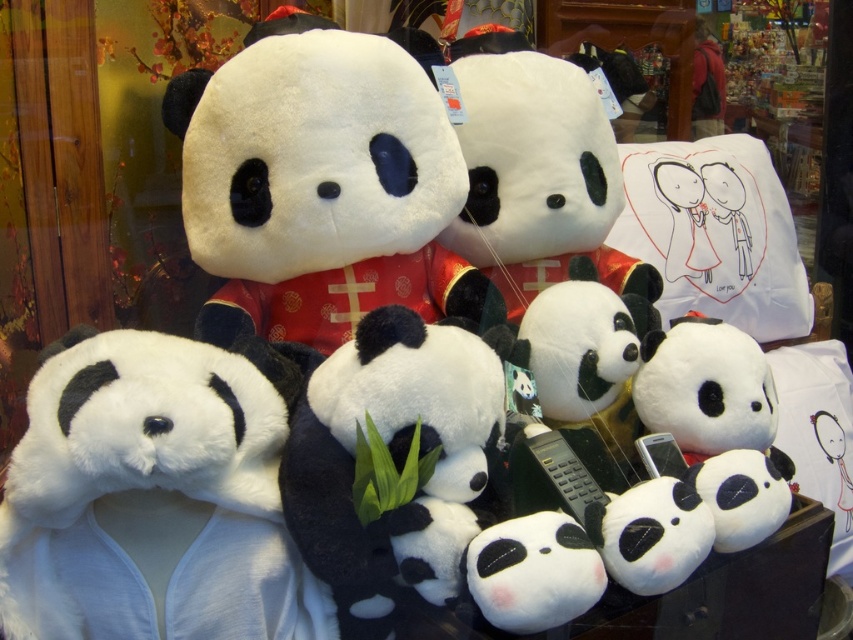
You are standing in front of the store window and want to point out the fluffy white panda at left. Based on its coordinates, which corner of the window is it closest to?

The fluffy white panda at left is at coordinates point [154,496], so it is closest to the bottom right corner of the window.

You are a customer in the store and want to buy a panda toy. The fluffy white panda at left is priced at 15 dollars and the soft plush panda at center is priced at 25 dollars. If you want the best value for money in terms of size, which panda should you choose?

The soft plush panda at center is larger than the fluffy white panda at left, so choosing the soft plush panda at center for 25 dollars provides better value for money in terms of size compared to the smaller fluffy white panda at left priced at 15 dollars.